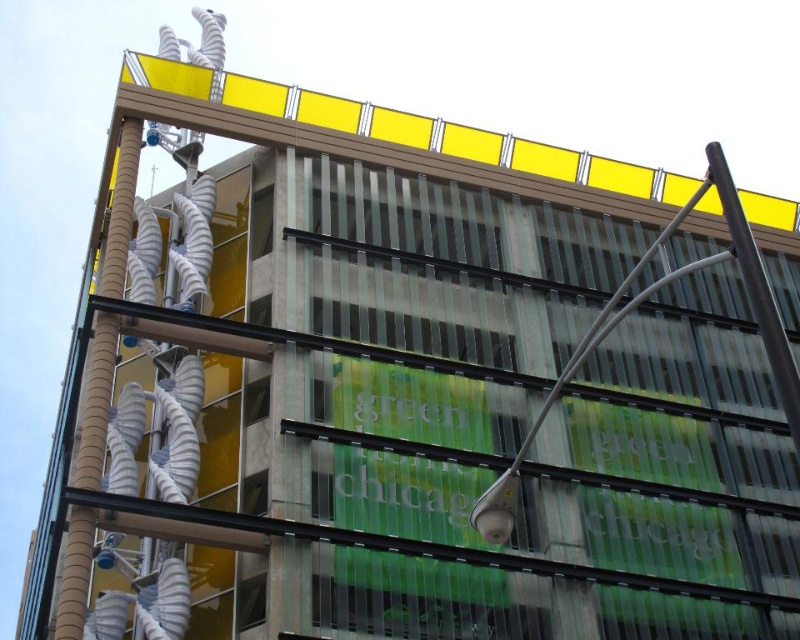
Question: Can you confirm if brown corrugated pipe at left is thinner than black metal pole at upper right?

Choices:
 (A) no
 (B) yes

Answer: (B)

Question: Which point appears farthest from the camera in this image?

Choices:
 (A) (84, 476)
 (B) (756, 266)

Answer: (A)

Question: Which object appears closest to the camera in this image?

Choices:
 (A) black metal pole at upper right
 (B) brown corrugated pipe at left

Answer: (A)

Question: Does brown corrugated pipe at left appear over black metal pole at upper right?

Choices:
 (A) no
 (B) yes

Answer: (A)

Question: Is brown corrugated pipe at left to the right of black metal pole at upper right from the viewer's perspective?

Choices:
 (A) yes
 (B) no

Answer: (B)